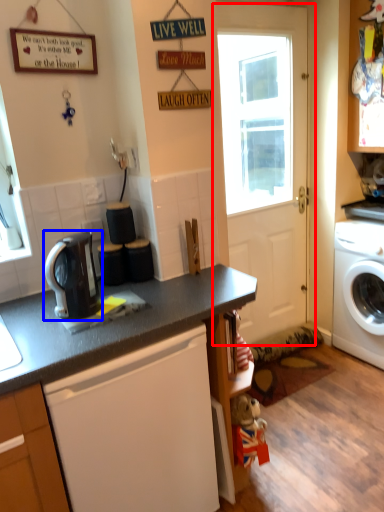
Question: Which object is closer to the camera taking this photo, door (highlighted by a red box) or kitchen appliance (highlighted by a blue box)?

Choices:
 (A) door
 (B) kitchen appliance

Answer: (B)